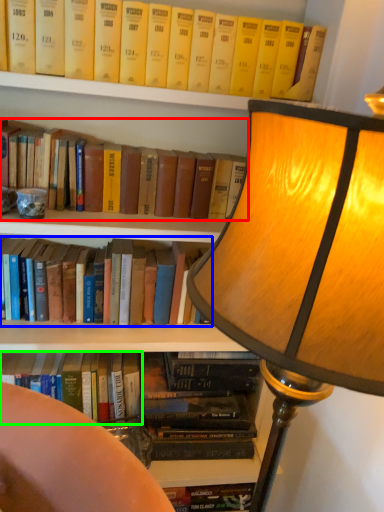
Question: Considering the real-world distances, which object is farthest from book (highlighted by a red box)? book (highlighted by a blue box) or book (highlighted by a green box)?

Choices:
 (A) book
 (B) book

Answer: (B)